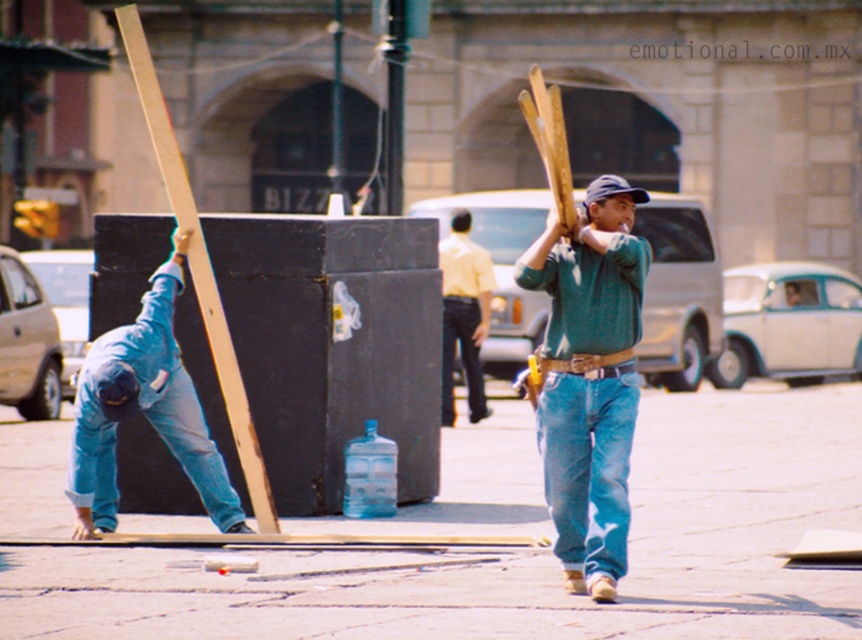
Does blue denim jeans at lower left lie behind yellow shirt at center?

No, it is in front of yellow shirt at center.

Who is more forward, (222, 496) or (438, 257)?

Positioned in front is point (222, 496).

At what (x,y) coordinates should I click in order to perform the action: click on blue denim jeans at lower left. Please return your answer as a coordinate pair (x, y). The image size is (862, 640). Looking at the image, I should click on (142, 410).

Can you confirm if green sweater at center is wider than blue denim jeans at lower left?

Incorrect, green sweater at center's width does not surpass blue denim jeans at lower left's.

Is green sweater at center to the left of blue denim jeans at lower left from the viewer's perspective?

Incorrect, green sweater at center is not on the left side of blue denim jeans at lower left.

Where is `green sweater at center`? Image resolution: width=862 pixels, height=640 pixels. green sweater at center is located at coordinates (589, 378).

Does green sweater at center have a smaller size compared to yellow shirt at center?

No, green sweater at center is not smaller than yellow shirt at center.

Which of these two, green sweater at center or yellow shirt at center, stands shorter?

green sweater at center

Where is `green sweater at center`? Image resolution: width=862 pixels, height=640 pixels. green sweater at center is located at coordinates (589, 378).

Where is `green sweater at center`? green sweater at center is located at coordinates (589, 378).